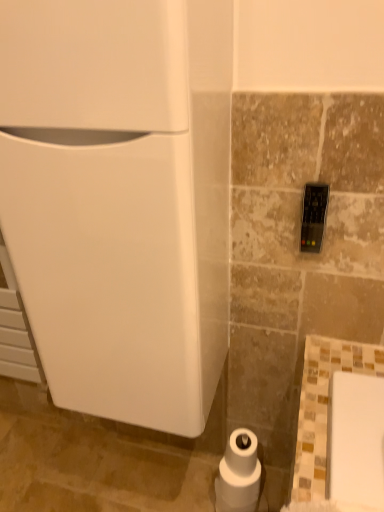
Question: Is point (258, 467) closer or farther from the camera than point (87, 41)?

Choices:
 (A) closer
 (B) farther

Answer: (B)

Question: In the image, is white matte toilet paper at center on the left side or the right side of white glossy refrigerator at left?

Choices:
 (A) left
 (B) right

Answer: (B)

Question: Relative to white glossy refrigerator at left, is white matte toilet paper at center in front or behind?

Choices:
 (A) front
 (B) behind

Answer: (B)

Question: Relative to white matte toilet paper at center, is white glossy refrigerator at left in front or behind?

Choices:
 (A) behind
 (B) front

Answer: (B)

Question: Is point (96, 227) positioned closer to the camera than point (221, 459)?

Choices:
 (A) farther
 (B) closer

Answer: (B)

Question: Would you say white glossy refrigerator at left is inside or outside white matte toilet paper at center?

Choices:
 (A) inside
 (B) outside

Answer: (B)

Question: From their relative heights in the image, would you say white glossy refrigerator at left is taller or shorter than white matte toilet paper at center?

Choices:
 (A) tall
 (B) short

Answer: (A)